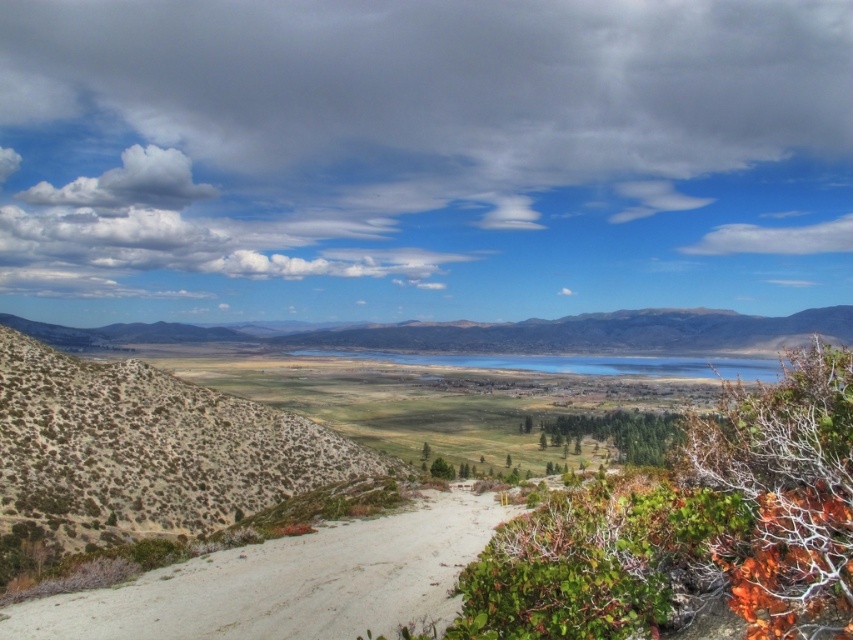
You are standing at the starting point of the white sandy dirt track at lower left and want to reach the rugged brown mountain at center. Which direction should you head to first?

The white sandy dirt track at lower left is in front of rugged brown mountain at center, so you should head towards the direction of the rugged brown mountain at center by following the white sandy dirt track at lower left as it leads towards it.

You are standing at the starting point of the sandy path and want to reach the point marked as point (215, 435). There is an obstacle at point (280, 401). Can you safely walk around the obstacle to reach your destination?

Point (280, 401) is closer to you than point (215, 435), so you can walk around the obstacle at point (280, 401) to reach the destination point (215, 435).